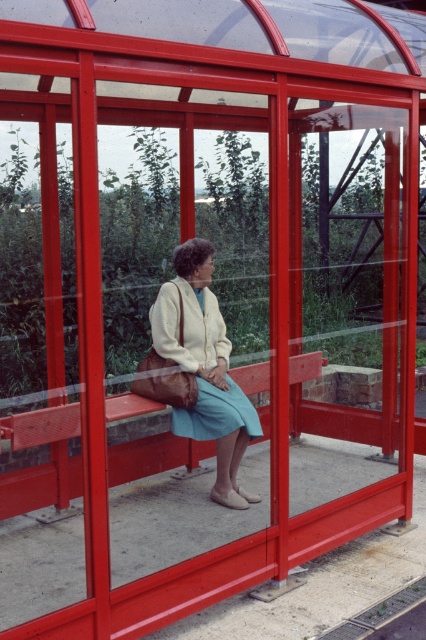
You are a tailor who needs to determine if the matte cream sweater at center can fit into a storage box designed for the wooden bench at center. Based on their sizes, will the sweater fit?

The matte cream sweater at center is larger in size than the wooden bench at center, so it cannot fit into a storage box designed for the wooden bench at center.

You are standing outside the red bus shelter and want to know which of the two points, point [215,449] or point [14,496], is closer to you. Based on the scene description, which point is nearer?

Point [215,449] is further to the viewer than point [14,496], so the closer point to you is point [14,496].

You are standing outside the red bus shelter and want to know where the matte cream sweater at center is positioned relative to the shelter. Can you determine its location based on the coordinates provided?

The matte cream sweater at center is located at point 0.577 on the x axis and 0.481 on the y axis within the shelter.